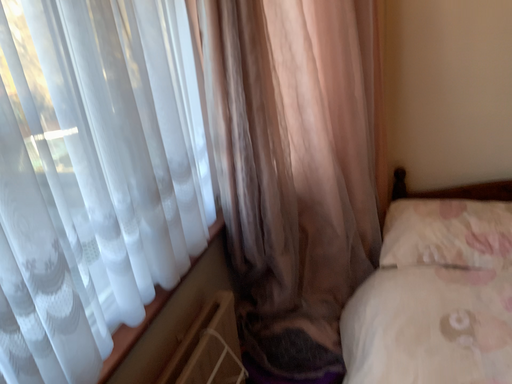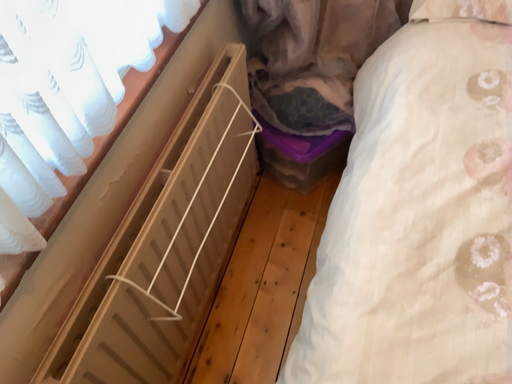
Question: How did the camera likely rotate when shooting the video?

Choices:
 (A) rotated upward
 (B) rotated downward

Answer: (B)